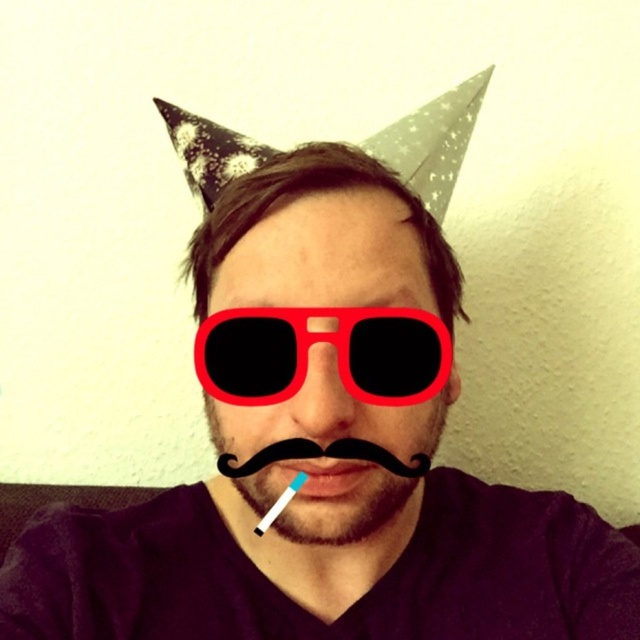
You are a photographer setting up for a photoshoot. You have a black fuzzy beard at center and a matte plastic toothbrush at center in front of you. Which object is taller?

The black fuzzy beard at center is taller than the matte plastic toothbrush at center.

Based on the scene description, which object is closer to the viewer, the red plastic sunglasses at center or the black fuzzy beard at center?

The red plastic sunglasses at center are closer to the viewer because the black fuzzy beard at center is behind them.